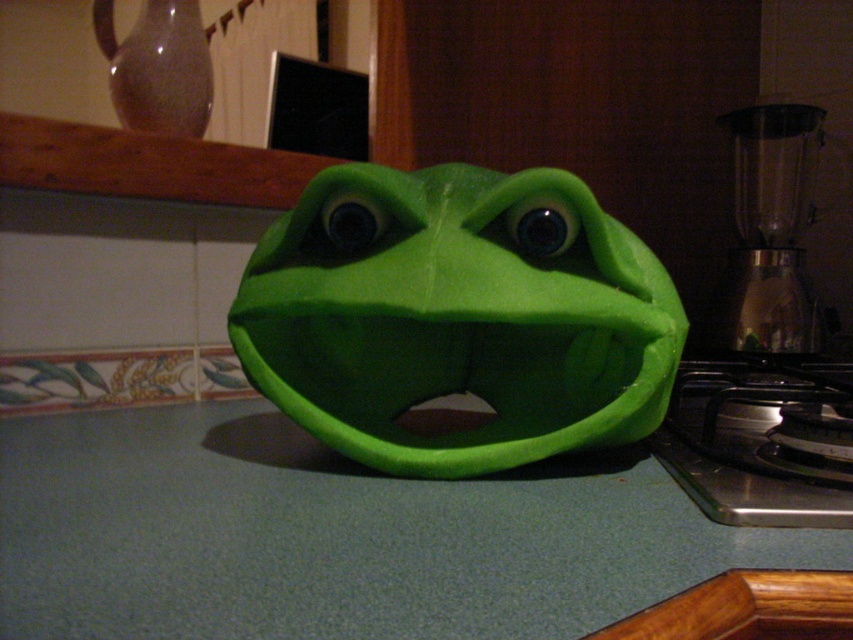
Is point (747, 541) more distant than point (737, 122)?

No.

You are a GUI agent. You are given a task and a screenshot of the screen. Output one action in this format:
    pyautogui.click(x=<x>, y=<y>)
    Task: Click on the green matte counter top at center
    This screenshot has height=640, width=853.
    Given the screenshot: What is the action you would take?
    pyautogui.click(x=335, y=536)

Which of these two, green matte mask at center or transparent glass blender at right, stands taller?

With more height is transparent glass blender at right.

In the scene shown: Is green matte mask at center to the right of transparent glass blender at right from the viewer's perspective?

In fact, green matte mask at center is to the left of transparent glass blender at right.

Is point (370, 346) more distant than point (770, 156)?

No.

I want to click on green matte mask at center, so click(457, 316).

Which is in front, point (120, 512) or point (587, 256)?

Point (120, 512)

Which of these two, green matte counter top at center or green matte mask at center, stands taller?

With more height is green matte mask at center.

Locate an element on the screen. The width and height of the screenshot is (853, 640). green matte counter top at center is located at coordinates (335, 536).